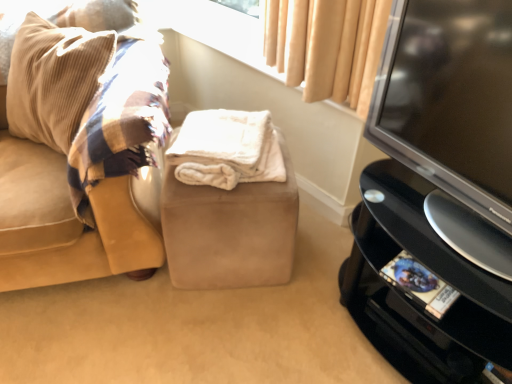
What do you see at coordinates (88, 138) in the screenshot? This screenshot has height=384, width=512. I see `suede couch at left` at bounding box center [88, 138].

Image resolution: width=512 pixels, height=384 pixels. I want to click on black glossy television at right, so click(452, 118).

Considering the sizes of objects suede beige stool at center and black glossy television at right in the image provided, who is wider, suede beige stool at center or black glossy television at right?

suede beige stool at center.

Which object is closer to the camera, suede beige stool at center or black glossy television at right?

Positioned in front is black glossy television at right.

Is suede beige stool at center aimed at black glossy television at right?

No, suede beige stool at center is not facing towards black glossy television at right.

How distant is suede couch at left from black plastic tv stand at right?

suede couch at left is 87.02 centimeters from black plastic tv stand at right.

Is suede couch at left facing towards black plastic tv stand at right?

No, suede couch at left is not oriented towards black plastic tv stand at right.

In the scene shown: From the image's perspective, is suede couch at left beneath black plastic tv stand at right?

Incorrect, from the image's perspective, suede couch at left is higher than black plastic tv stand at right.

Considering the sizes of suede beige stool at center and suede couch at left in the image, is suede beige stool at center wider or thinner than suede couch at left?

Considering their sizes, suede beige stool at center looks slimmer than suede couch at left.

From a real-world perspective, which is physically below, suede beige stool at center or suede couch at left?

In real-world perspective, suede beige stool at center is lower.

Where is `studio couch lying on the left of suede beige stool at center`? studio couch lying on the left of suede beige stool at center is located at coordinates (88, 138).

Is suede beige stool at center to the left of suede couch at left from the viewer's perspective?

No, suede beige stool at center is not to the left of suede couch at left.

Which is behind, point (232, 196) or point (192, 133)?

The point (192, 133) is farther from the camera.

Would you say suede beige stool at center is to the left or to the right of white fluffy blanket at center in the picture?

suede beige stool at center is positioned on white fluffy blanket at center's right side.

Between suede beige stool at center and white fluffy blanket at center, which one has smaller width?

Thinner between the two is white fluffy blanket at center.

Is suede beige stool at center taller or shorter than white fluffy blanket at center?

In the image, suede beige stool at center appears to be taller than white fluffy blanket at center.

Looking at this image, from a real-world perspective, which object stands above the other?

white fluffy blanket at center is physically above.

From the image's perspective, relative to white fluffy blanket at center, is black plastic tv stand at right above or below?

black plastic tv stand at right is below white fluffy blanket at center.

Is black plastic tv stand at right surrounding white fluffy blanket at center?

Actually, white fluffy blanket at center is outside black plastic tv stand at right.

Which point is more distant from viewer, (371, 129) or (454, 261)?

The point (371, 129) is behind.

Is black glossy television at right facing towards black plastic tv stand at right?

No.

Looking at this image, how far apart are black glossy television at right and black plastic tv stand at right?

black glossy television at right and black plastic tv stand at right are 9.58 inches apart from each other.

There is a black plastic tv stand at right. Where is `television above it (from a real-world perspective)`? The height and width of the screenshot is (384, 512). television above it (from a real-world perspective) is located at coordinates (452, 118).

Is suede couch at left turned away from white fluffy blanket at center?

No, suede couch at left's orientation is not away from white fluffy blanket at center.

How different are the orientations of suede couch at left and white fluffy blanket at center in degrees?

They differ by 8.71 degrees in their facing directions.

In the scene shown: Considering the sizes of objects suede couch at left and white fluffy blanket at center in the image provided, who is thinner, suede couch at left or white fluffy blanket at center?

white fluffy blanket at center is thinner.

From the image's perspective, which is below, suede couch at left or white fluffy blanket at center?

white fluffy blanket at center, from the image's perspective.

Identify the location of television in front of the suede beige stool at center. (452, 118).

Locate an element on the screen. The height and width of the screenshot is (384, 512). studio couch located on the left of black plastic tv stand at right is located at coordinates (88, 138).

Which object lies nearer to the anchor point white fluffy blanket at center, beige fabric at upper center or suede couch at left?

Based on the image, suede couch at left appears to be nearer to white fluffy blanket at center.

Estimate the real-world distances between objects in this image. Which object is further from suede couch at left, white fluffy blanket at center or beige fabric at upper center?

beige fabric at upper center is further to suede couch at left.

Based on their spatial positions, is black glossy television at right or suede couch at left further from white fluffy blanket at center?

Among the two, black glossy television at right is located further to white fluffy blanket at center.

Estimate the real-world distances between objects in this image. Which object is closer to black plastic tv stand at right, beige fabric at upper center or black glossy television at right?

Based on the image, black glossy television at right appears to be nearer to black plastic tv stand at right.

From the image, which object appears to be farther from suede couch at left, white fluffy blanket at center or suede beige stool at center?

The object further to suede couch at left is suede beige stool at center.

Considering their positions, is suede beige stool at center positioned further to black glossy television at right than white fluffy blanket at center?

suede beige stool at center is positioned further to the anchor black glossy television at right.

Which object lies further to the anchor point suede beige stool at center, black plastic tv stand at right or black glossy television at right?

Among the two, black glossy television at right is located further to suede beige stool at center.

Which object lies further to the anchor point suede beige stool at center, black glossy television at right or beige fabric at upper center?

Among the two, beige fabric at upper center is located further to suede beige stool at center.

The height and width of the screenshot is (384, 512). What are the coordinates of `stool located between suede couch at left and black glossy television at right in the left-right direction` in the screenshot? It's located at (230, 231).

Locate an element on the screen. This screenshot has width=512, height=384. television located between suede beige stool at center and black plastic tv stand at right in the left-right direction is located at coordinates (452, 118).

In order to click on blanket located between suede couch at left and black plastic tv stand at right in the left-right direction in this screenshot , I will do `click(227, 149)`.

Locate an element on the screen. blanket between black glossy television at right and suede beige stool at center along the z-axis is located at coordinates point(227,149).